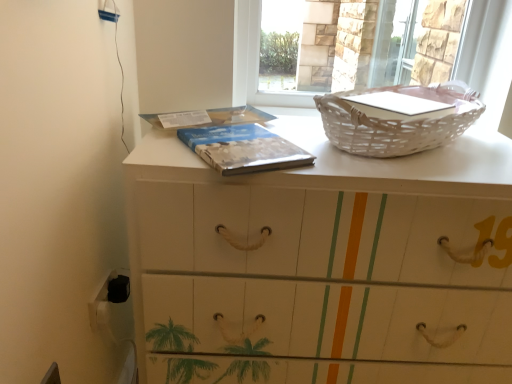
In order to click on vacant area that lies between blue textured book at center and white wicker basket at upper right in this screenshot , I will do `click(332, 147)`.